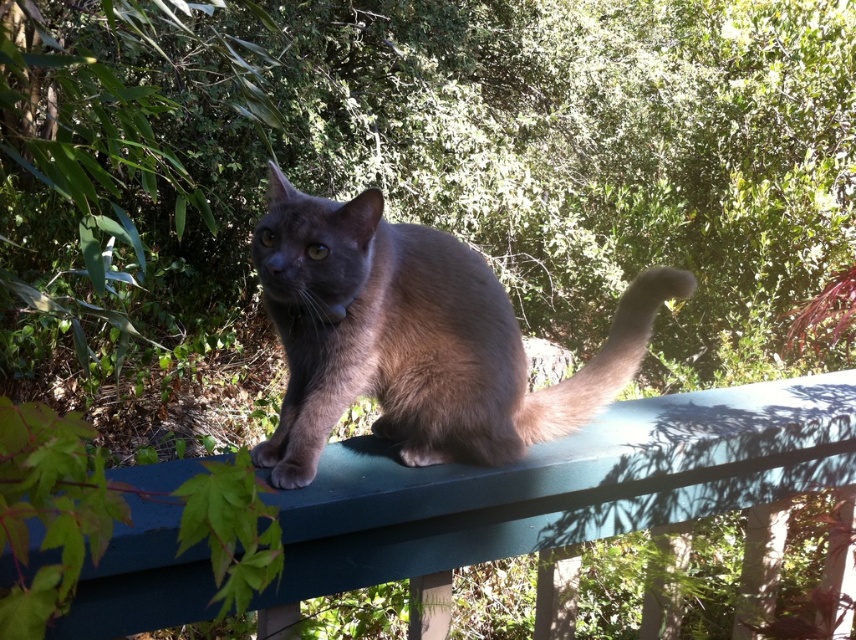
Can you confirm if green painted wood at center is positioned below matte gray cat at center?

Correct, green painted wood at center is located below matte gray cat at center.

Which is below, green painted wood at center or matte gray cat at center?

green painted wood at center is below.

You are a GUI agent. You are given a task and a screenshot of the screen. Output one action in this format:
    pyautogui.click(x=<x>, y=<y>)
    Task: Click on the green painted wood at center
    
    Given the screenshot: What is the action you would take?
    pyautogui.click(x=563, y=484)

I want to click on green painted wood at center, so click(563, 484).

Measure the distance from matte gray cat at center to fuzzy brown tail at upper center.

matte gray cat at center and fuzzy brown tail at upper center are 23.88 centimeters apart from each other.

Can you confirm if matte gray cat at center is wider than fuzzy brown tail at upper center?

Indeed, matte gray cat at center has a greater width compared to fuzzy brown tail at upper center.

Does point (629, 308) come behind point (646, 342)?

No, (629, 308) is closer to viewer.

Identify the location of matte gray cat at center. (415, 339).

Is point (559, 486) closer to viewer compared to point (628, 365)?

Yes, point (559, 486) is closer to viewer.

Can you confirm if green painted wood at center is positioned to the left of fuzzy brown tail at upper center?

Indeed, green painted wood at center is positioned on the left side of fuzzy brown tail at upper center.

Between point (147, 605) and point (679, 272), which one is positioned in front?

Point (147, 605)

This screenshot has width=856, height=640. In order to click on green painted wood at center in this screenshot , I will do `click(563, 484)`.